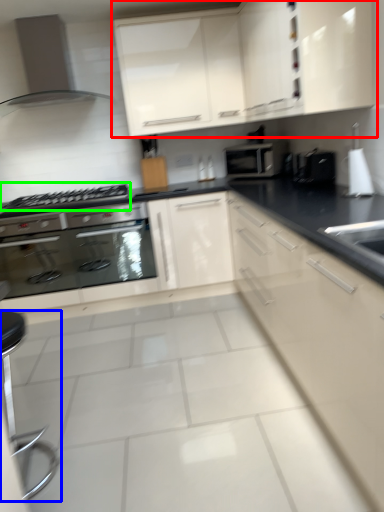
Question: Which object is positioned closest to cabinetry (highlighted by a red box)? Select from bar stool (highlighted by a blue box) and gas stove (highlighted by a green box).

Choices:
 (A) bar stool
 (B) gas stove

Answer: (B)